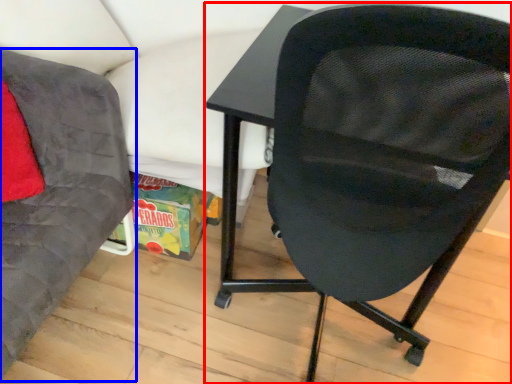
Question: Which object appears closest to the camera in this image, chair (highlighted by a red box) or chair (highlighted by a blue box)?

Choices:
 (A) chair
 (B) chair

Answer: (B)